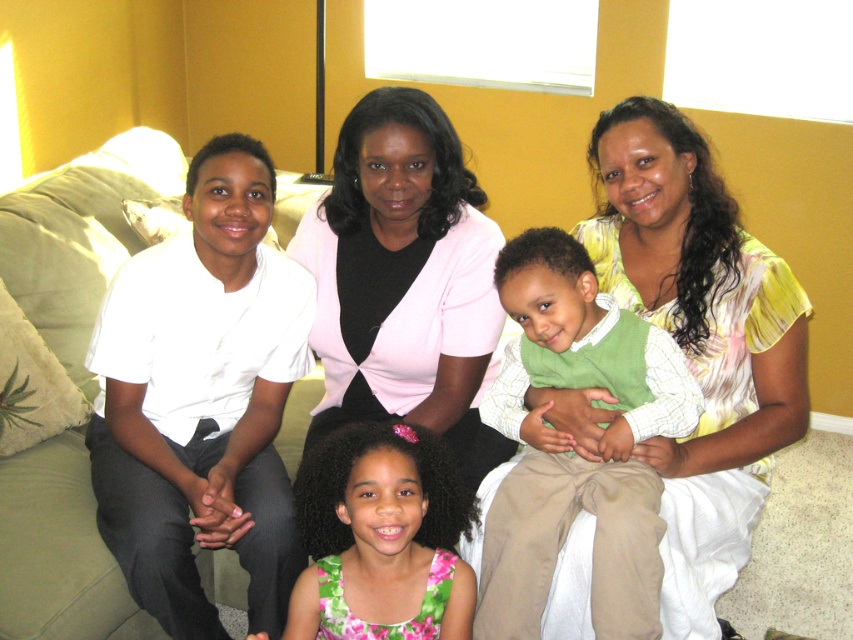
Locate an element on the screen. white smooth shirt at left is located at coordinates (202, 400).

Is white smooth shirt at left to the left of pink satin blouse at center from the viewer's perspective?

Indeed, white smooth shirt at left is positioned on the left side of pink satin blouse at center.

Does point (242, 154) lie behind point (422, 195)?

No, (242, 154) is closer to viewer.

Identify the location of white smooth shirt at left. (202, 400).

In the scene shown: Who is more forward, (x=619, y=282) or (x=340, y=440)?

Point (x=340, y=440)

Is matte white shirt at left wider than green floral dress at center?

Indeed, matte white shirt at left has a greater width compared to green floral dress at center.

Is point (784, 324) positioned in front of point (339, 541)?

No, it is not.

Where is `matte white shirt at left`? Image resolution: width=853 pixels, height=640 pixels. matte white shirt at left is located at coordinates (698, 294).

Is pink satin blouse at center shorter than green floral dress at center?

Incorrect, pink satin blouse at center's height does not fall short of green floral dress at center's.

How much distance is there between pink satin blouse at center and green floral dress at center?

pink satin blouse at center is 34.60 centimeters from green floral dress at center.

Locate an element on the screen. pink satin blouse at center is located at coordinates (403, 280).